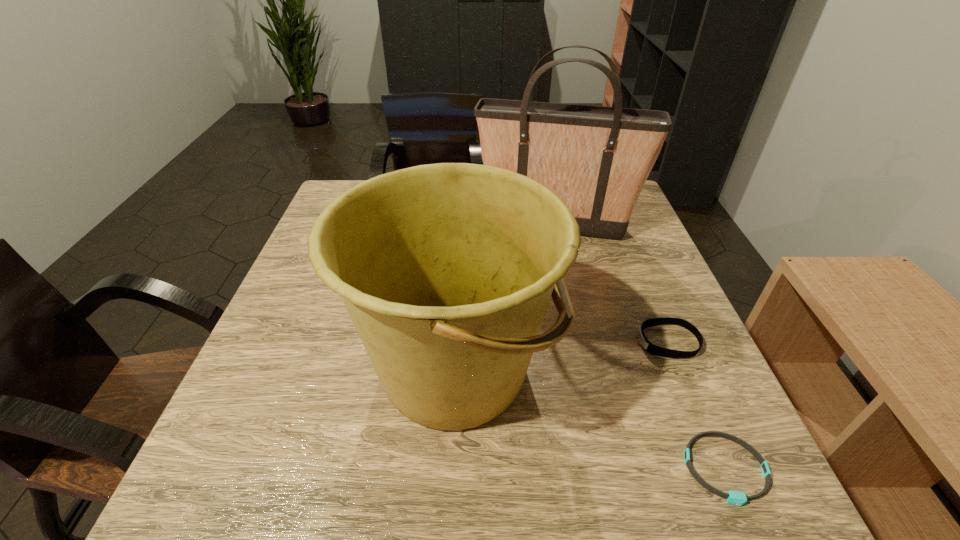
At what (x,y) coordinates should I click in order to perform the action: click on vacant point located 0.210m on the display of the third tallest object. Please return your answer as a coordinate pair (x, y). Image resolution: width=960 pixels, height=540 pixels. Looking at the image, I should click on (530, 342).

In order to click on vacant region located 0.270m on the display of the third tallest object in this screenshot , I will do [500, 342].

I want to click on object present at the far edge, so click(597, 159).

The height and width of the screenshot is (540, 960). Find the location of `bucket that is positioned at the near edge`. bucket that is positioned at the near edge is located at coordinates (446, 270).

This screenshot has height=540, width=960. Identify the location of wristband present at the near edge. (733, 497).

You are a GUI agent. You are given a task and a screenshot of the screen. Output one action in this format:
    pyautogui.click(x=<x>, y=<y>)
    Task: Click on the shopping bag that is at the right edge
    
    Given the screenshot: What is the action you would take?
    pyautogui.click(x=597, y=159)

Where is `object at the far right corner`? This screenshot has width=960, height=540. object at the far right corner is located at coordinates (597, 159).

Find the location of a particular element. Image resolution: width=960 pixels, height=540 pixels. object at the near right corner is located at coordinates point(733,497).

Where is `blank space at the left edge of the desktop`? Image resolution: width=960 pixels, height=540 pixels. blank space at the left edge of the desktop is located at coordinates (332, 321).

Where is `free point at the right edge`? The width and height of the screenshot is (960, 540). free point at the right edge is located at coordinates (669, 448).